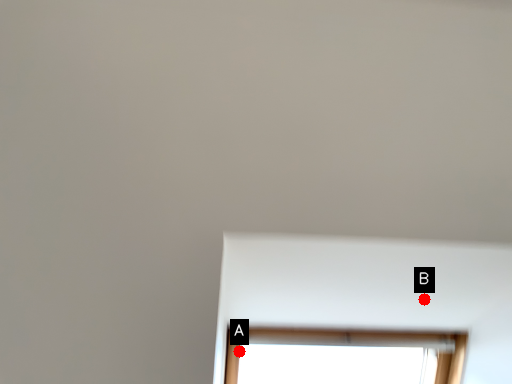
Question: Two points are circled on the image, labeled by A and B beside each circle. Among these points, which one is farthest from the camera?

Choices:
 (A) A is further
 (B) B is further

Answer: (A)